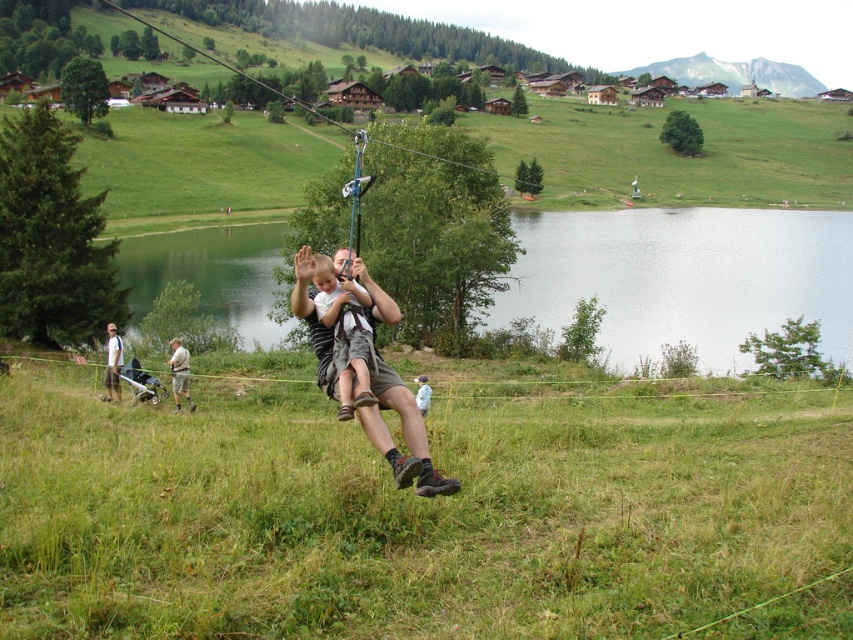
You are a photographer trying to capture a photo of the light brown fabric shorts at center and the khaki shorts at lower left. Which pair of shorts will appear larger in the photo?

The light brown fabric shorts at center will appear larger in the photo because it is much taller than the khaki shorts at lower left.

You are a photographer trying to capture the person and the child on the zip line. Since the light brown fabric shorts at center and khaki shorts at lower left are in your view, which pair of shorts is covering part of the other?

The light brown fabric shorts at center is positioned over khaki shorts at lower left, so the light brown fabric shorts at center is covering part of the khaki shorts at lower left.

You are standing at the top left corner of the zip line and want to know where the green water at center is located. Based on the coordinates provided, can you determine its position relative to the zip line cable?

The green water at center is located at coordinates point (685, 276), which is towards the lower part of the image since the y coordinate is closer to 1.0. Since the zip line cable stretches from the top left to the center, the green water at center is positioned below and to the right of the zip line cable.